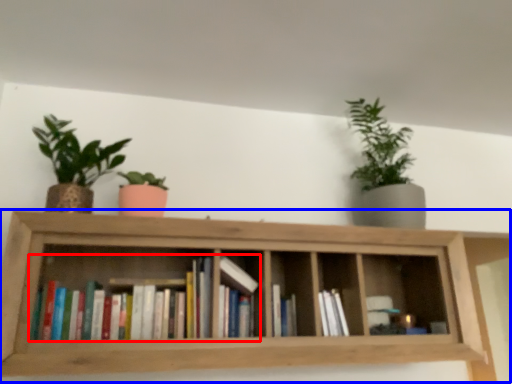
Question: Which object appears closest to the camera in this image, book (highlighted by a red box) or shelf (highlighted by a blue box)?

Choices:
 (A) book
 (B) shelf

Answer: (B)